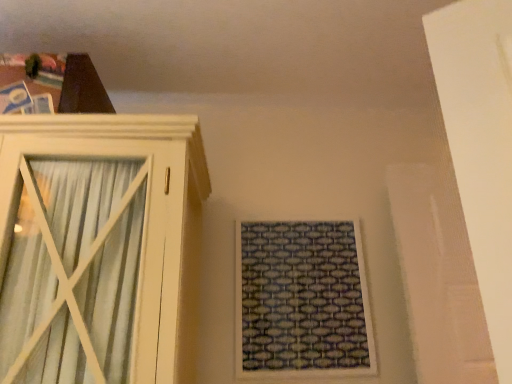
Locate an element on the screen. textured fabric at center is located at coordinates (302, 300).

This screenshot has height=384, width=512. Describe the element at coordinates (302, 300) in the screenshot. I see `textured fabric at center` at that location.

Locate an element on the screen. The image size is (512, 384). textured fabric at center is located at coordinates (302, 300).